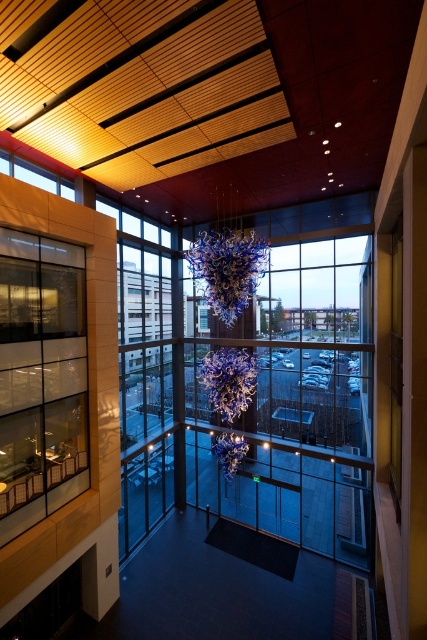
Question: Can you confirm if clear glass window at left is positioned to the left of transparent glass window at upper left?

Choices:
 (A) yes
 (B) no

Answer: (B)

Question: Which point is farther to the camera?

Choices:
 (A) transparent glass window at upper left
 (B) clear glass window at left

Answer: (A)

Question: In this image, where is clear glass window at left located relative to transparent glass window at upper left?

Choices:
 (A) right
 (B) left

Answer: (A)

Question: Is clear glass window at left to the right of transparent glass window at upper left from the viewer's perspective?

Choices:
 (A) no
 (B) yes

Answer: (B)